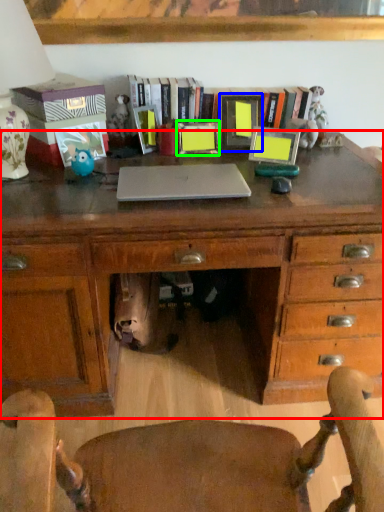
Question: Estimate the real-world distances between objects in this image. Which object is farther from desk (highlighted by a red box), picture frame (highlighted by a blue box) or picture frame (highlighted by a green box)?

Choices:
 (A) picture frame
 (B) picture frame

Answer: (B)